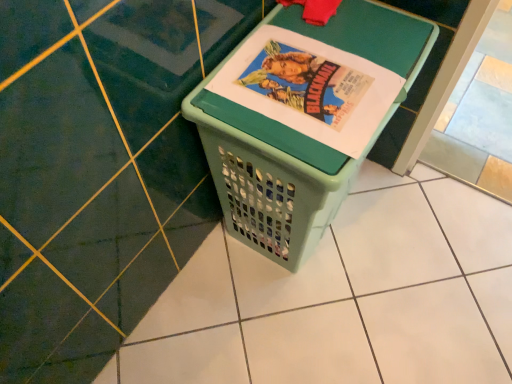
Identify the location of empty space that is ontop of green plastic laundry basket at center (from a real-world perspective). Image resolution: width=512 pixels, height=384 pixels. (315, 65).